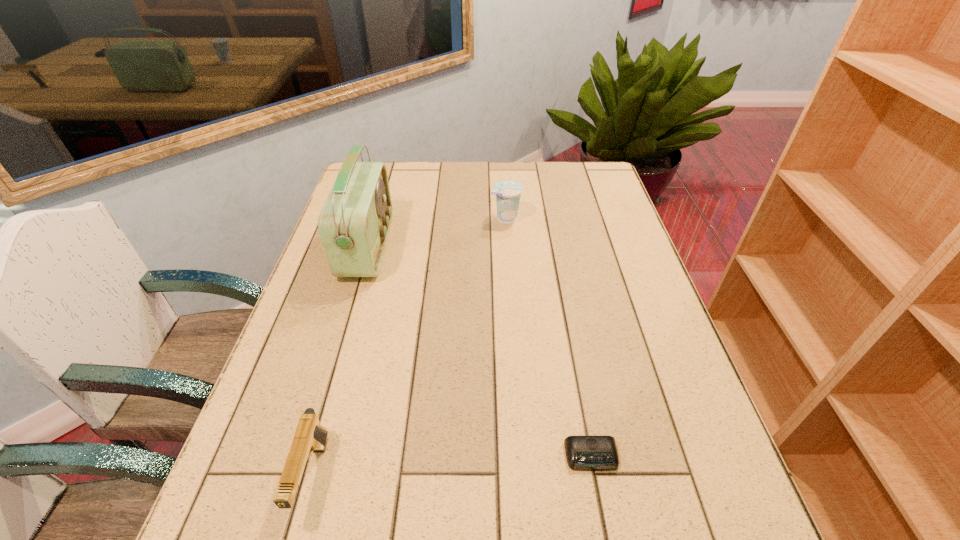
Identify the location of free spot between the alarm clock and the tallest object. This screenshot has width=960, height=540. (479, 352).

This screenshot has height=540, width=960. Find the location of `free space between the radio receiver and the rightmost object`. free space between the radio receiver and the rightmost object is located at coordinates (479, 352).

Identify the location of empty space between the tallest object and the third object from left to right. (437, 233).

Where is `free area in between the tallest object and the third object from left to right`? free area in between the tallest object and the third object from left to right is located at coordinates (437, 233).

Image resolution: width=960 pixels, height=540 pixels. I want to click on free spot between the alarm clock and the yogurt, so click(x=548, y=337).

The width and height of the screenshot is (960, 540). Identify the location of free area in between the rightmost object and the yogurt. (548, 337).

Find the location of a particular element. The image size is (960, 540). object that is the closest to the radio receiver is located at coordinates (507, 192).

Locate an element on the screen. Image resolution: width=960 pixels, height=540 pixels. the third closest object relative to the yogurt is located at coordinates (309, 436).

Locate an element on the screen. The width and height of the screenshot is (960, 540). blank area in the image that satisfies the following two spatial constraints: 1. on the front side of the yogurt; 2. on the front panel of the tallest object is located at coordinates (508, 247).